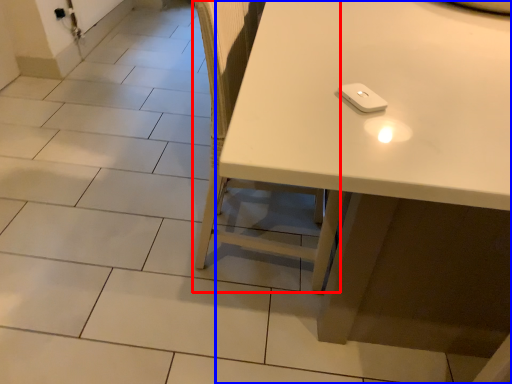
Question: Which of the following is the farthest to the observer, chair (highlighted by a red box) or table (highlighted by a blue box)?

Choices:
 (A) chair
 (B) table

Answer: (A)